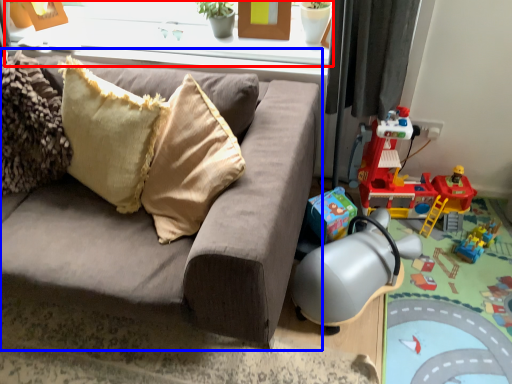
Question: Which point is further to the camera, window frame (highlighted by a red box) or studio couch (highlighted by a blue box)?

Choices:
 (A) window frame
 (B) studio couch

Answer: (A)